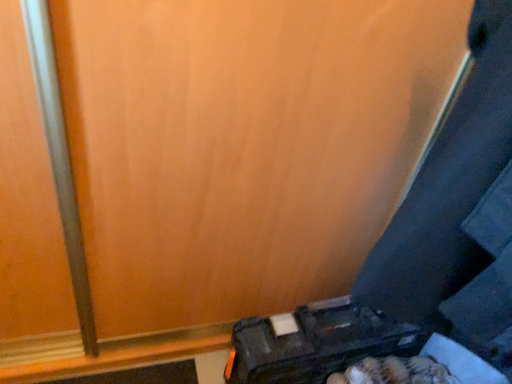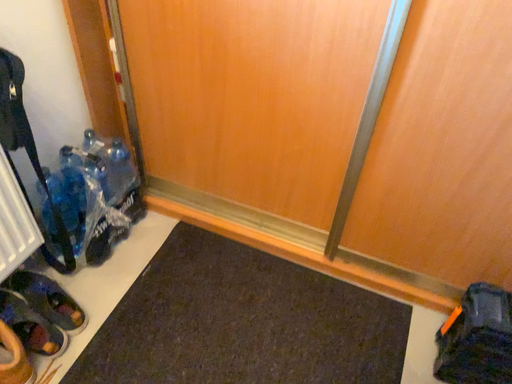
Question: Which way did the camera rotate in the video?

Choices:
 (A) rotated left
 (B) rotated right

Answer: (A)